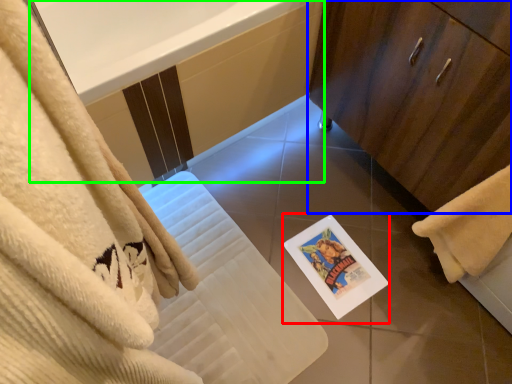
Question: Which object is the farthest from postcard (highlighted by a red box)? Choose among these: bathroom cabinet (highlighted by a blue box) or bath (highlighted by a green box).

Choices:
 (A) bathroom cabinet
 (B) bath

Answer: (B)